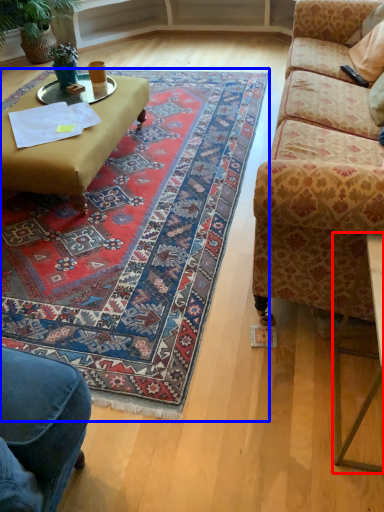
Question: Which object is closer to the camera taking this photo, table (highlighted by a red box) or mat (highlighted by a blue box)?

Choices:
 (A) table
 (B) mat

Answer: (A)